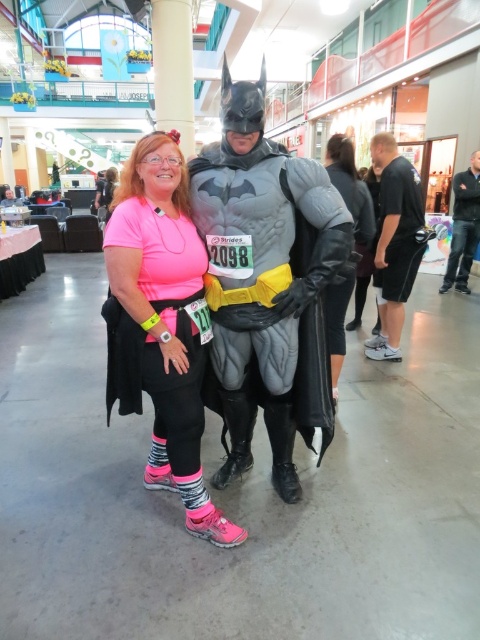
You are a photographer trying to capture the neon pink fabric leggings at center and the black mesh shorts at right in the same frame. Which object should you focus on first if you want to ensure both are in the frame without moving the camera?

The neon pink fabric leggings at center is positioned on the left side of black mesh shorts at right, so you should focus on the neon pink fabric leggings at center first to ensure both are within the frame without moving the camera.

You are a photographer setting up a shoot in the mall. You notice two pieces of clothing in the scene, the neon pink fabric leggings at center and the black mesh shorts at right. Which clothing item is positioned lower in the image?

The neon pink fabric leggings at center is located below the black mesh shorts at right, so it is positioned lower in the image.